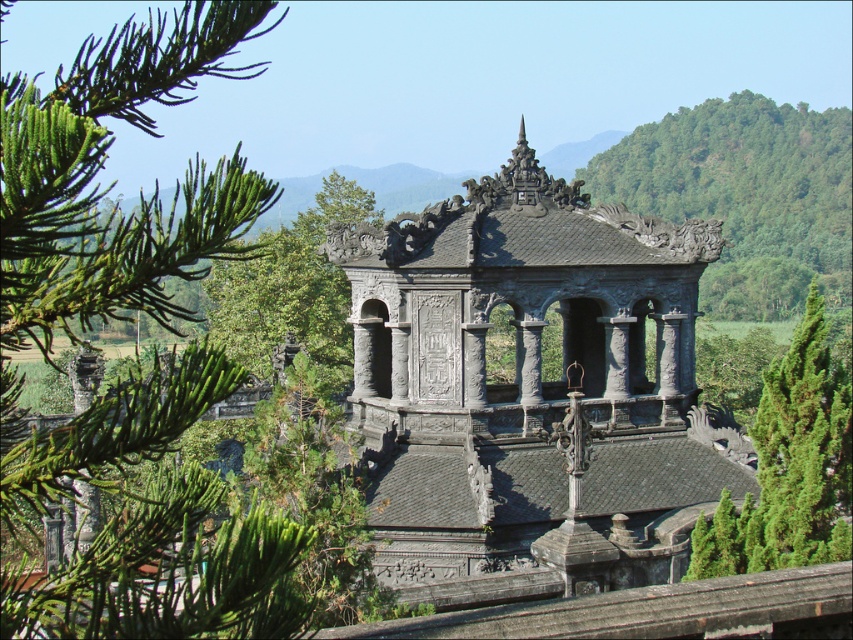
Question: Which point is farther from the camera taking this photo?

Choices:
 (A) (613, 193)
 (B) (445, 388)

Answer: (A)

Question: Observing the image, what is the correct spatial positioning of green leafy tree at upper right in reference to green textured tree at right?

Choices:
 (A) above
 (B) below

Answer: (A)

Question: Which point is closer to the camera?

Choices:
 (A) green textured tree at right
 (B) dark gray stone gazebo at center

Answer: (A)

Question: Can you confirm if dark gray stone gazebo at center is bigger than green textured tree at right?

Choices:
 (A) no
 (B) yes

Answer: (B)

Question: Which object is farther from the camera taking this photo?

Choices:
 (A) green textured tree at right
 (B) green leafy tree at upper right
 (C) dark gray stone gazebo at center

Answer: (B)

Question: Does green leafy tree at upper right appear on the right side of green textured tree at right?

Choices:
 (A) yes
 (B) no

Answer: (A)